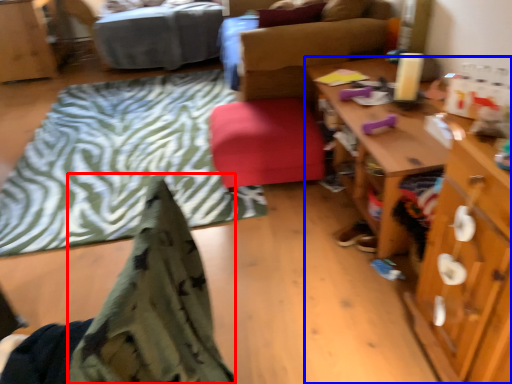
Question: Which of the following is the farthest to the observer, blanket (highlighted by a red box) or desk (highlighted by a blue box)?

Choices:
 (A) blanket
 (B) desk

Answer: (B)